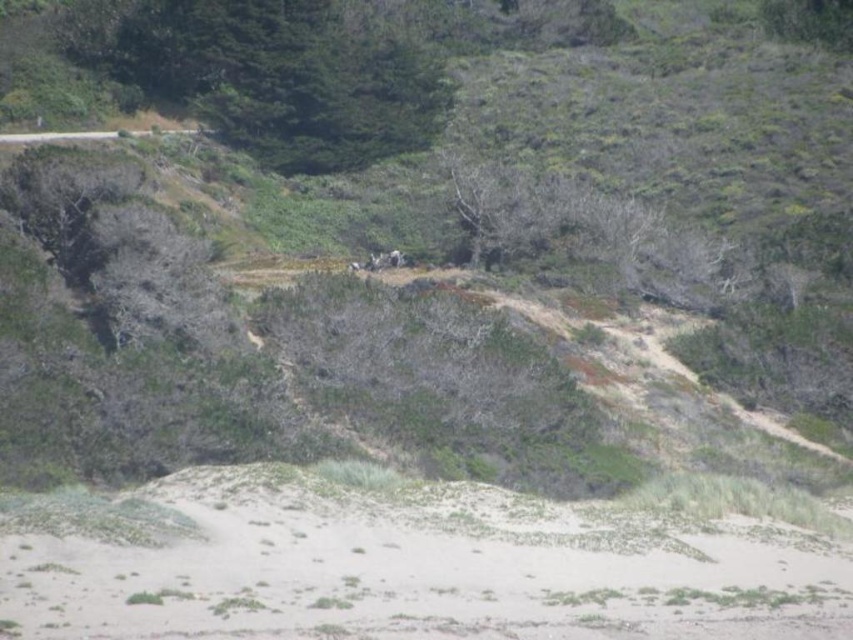
How distant is white sandy beach at lower center from green leafy tree at upper center?

white sandy beach at lower center and green leafy tree at upper center are 38.51 meters apart.

This screenshot has height=640, width=853. I want to click on white sandy beach at lower center, so click(401, 564).